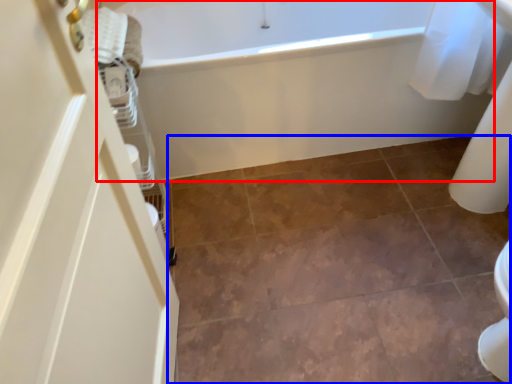
Question: Which object is closer to the camera taking this photo, bathtub (highlighted by a red box) or ceramic tile (highlighted by a blue box)?

Choices:
 (A) bathtub
 (B) ceramic tile

Answer: (B)